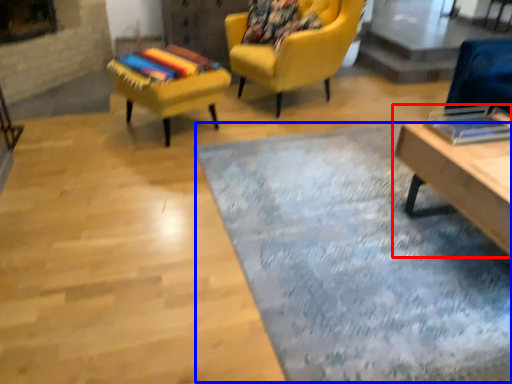
Question: Among these objects, which one is farthest to the camera, table (highlighted by a red box) or mat (highlighted by a blue box)?

Choices:
 (A) table
 (B) mat

Answer: (A)